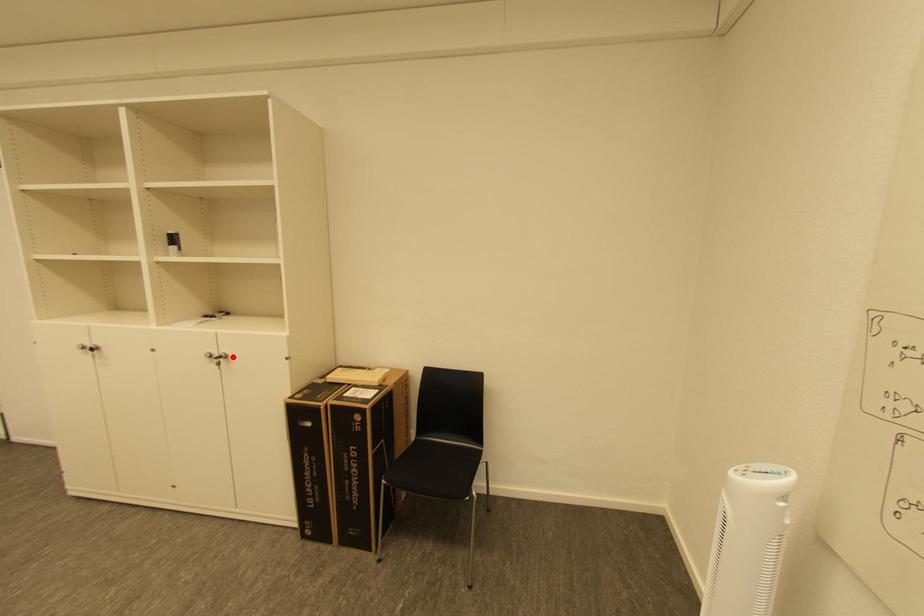
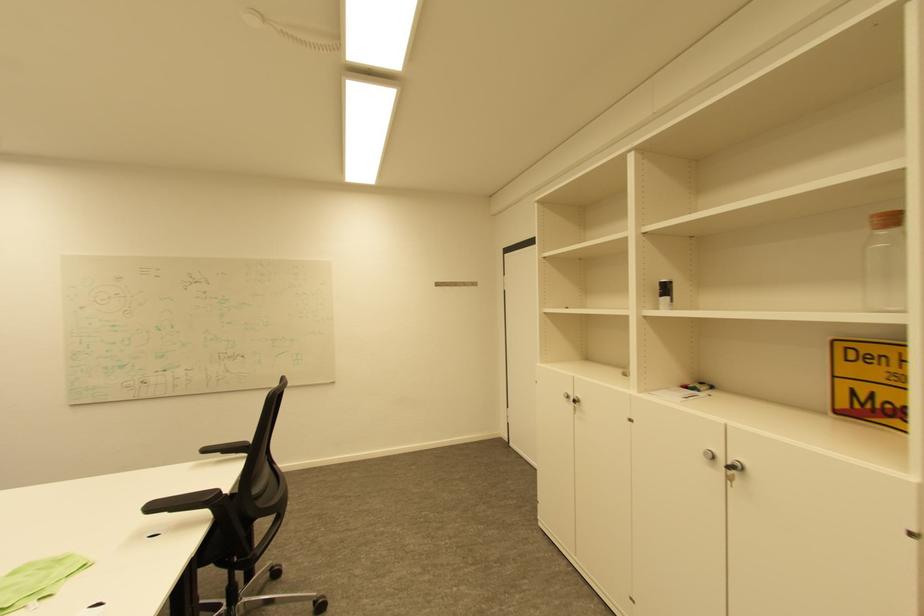
Where in the second image is the point corresponding to the highlighted location from the first image?

(748, 469)